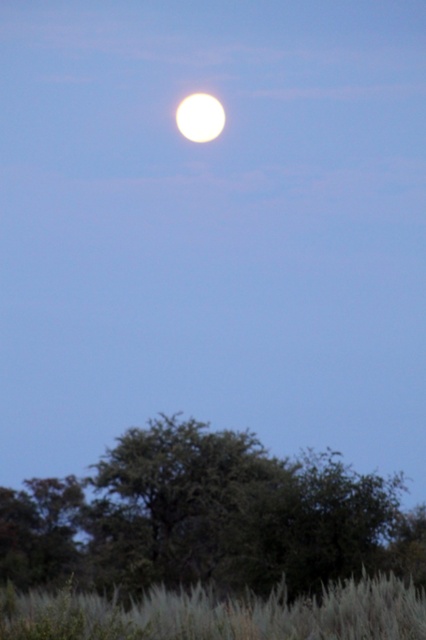
You are an astronomer observing the night sky and notice the green leafy tree at lower center and the bright white sphere at upper center. Which object is located higher in the sky?

The bright white sphere at upper center is higher in the sky than the green leafy tree at lower center.

You are an astronomer observing the night sky. You notice the silvery grass at lower center and the bright white sphere at upper center. Which object is positioned higher in the sky?

The bright white sphere at upper center is positioned higher in the sky than the silvery grass at lower center.

You are standing at the center of the image and want to walk towards the green leafy tree at lower center. In which direction should you move?

The green leafy tree at lower center is located at point coordinates, so you should move downward from the center to reach it.